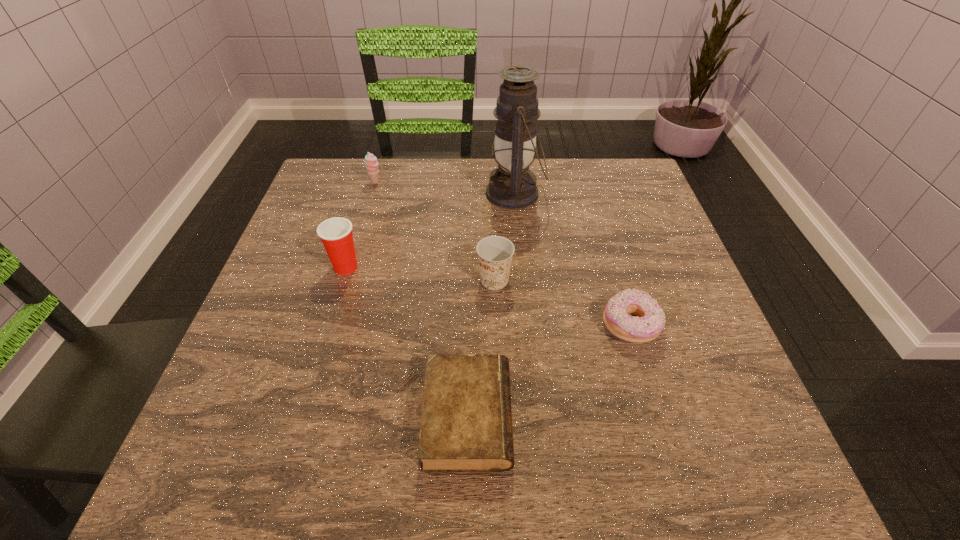
Identify the location of empty location between the nearest object and the sherbert. The width and height of the screenshot is (960, 540). (421, 299).

You are a GUI agent. You are given a task and a screenshot of the screen. Output one action in this format:
    pyautogui.click(x=<x>, y=<y>)
    Task: Click on the free point between the left Dixie cup and the right Dixie cup
    The image size is (960, 540).
    Given the screenshot: What is the action you would take?
    pyautogui.click(x=420, y=273)

Where is `empty location between the oil lamp and the second shortest object`? This screenshot has width=960, height=540. empty location between the oil lamp and the second shortest object is located at coordinates click(x=573, y=260).

The image size is (960, 540). What are the coordinates of `unoccupied position between the sherbert and the diary` in the screenshot? It's located at pos(421,299).

You are a GUI agent. You are given a task and a screenshot of the screen. Output one action in this format:
    pyautogui.click(x=<x>, y=<y>)
    Task: Click on the free area in between the doughnut and the diary
    
    Given the screenshot: What is the action you would take?
    pyautogui.click(x=549, y=371)

This screenshot has height=540, width=960. I want to click on free spot between the fifth shortest object and the rightmost object, so click(489, 296).

Identify which object is the second nearest to the shorter Dixie cup. Please provide its 2D coordinates. Your answer should be formatted as a tuple, i.e. [(x, y)], where the tuple contains the x and y coordinates of a point satisfying the conditions above.

[(512, 185)]

Choose which object is the fifth nearest neighbor to the diary. Please provide its 2D coordinates. Your answer should be formatted as a tuple, i.e. [(x, y)], where the tuple contains the x and y coordinates of a point satisfying the conditions above.

[(371, 162)]

At what (x,y) coordinates should I click in order to perform the action: click on free space that satisfies the following two spatial constraints: 1. on the front side of the shorter Dixie cup; 2. on the left side of the taller Dixie cup. Please return your answer as a coordinate pair (x, y). The width and height of the screenshot is (960, 540). Looking at the image, I should click on (x=342, y=280).

Find the location of a particular element. free space that satisfies the following two spatial constraints: 1. on the front side of the oil lamp; 2. on the right side of the sherbert is located at coordinates (372, 193).